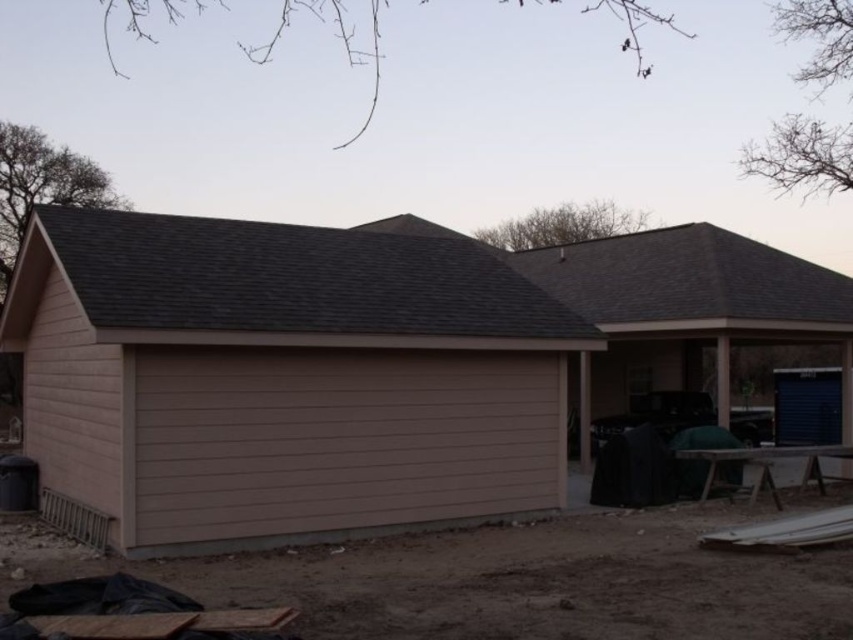
Find the location of a particular element. The width and height of the screenshot is (853, 640). beige siding garage at center is located at coordinates (354, 364).

Between beige siding garage at center and gray shingles at upper center, which one is positioned lower?

beige siding garage at center is below.

I want to click on beige siding garage at center, so click(x=354, y=364).